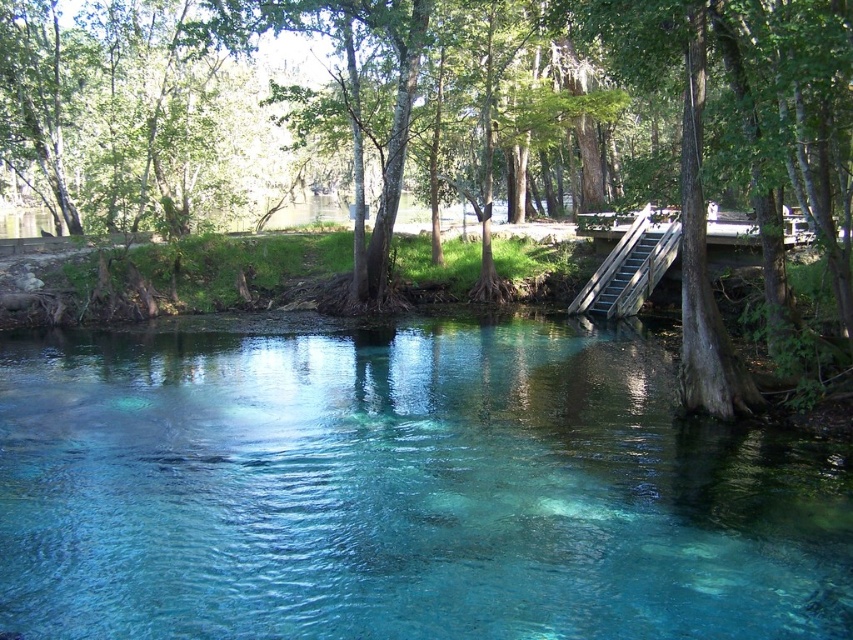
Which is behind, point (4, 580) or point (664, 246)?

Positioned behind is point (664, 246).

Is point (143, 483) in front of point (643, 257)?

Yes, it is in front of point (643, 257).

Find the location of `clear glassy water at center`. clear glassy water at center is located at coordinates (399, 492).

This screenshot has width=853, height=640. I want to click on clear glassy water at center, so click(x=399, y=492).

Does clear glassy water at center have a lesser height compared to green rough bark tree at center?

Correct, clear glassy water at center is not as tall as green rough bark tree at center.

Is point (223, 589) positioned behind point (659, 17)?

No, (223, 589) is in front of (659, 17).

Where is `clear glassy water at center`? clear glassy water at center is located at coordinates (399, 492).

Is point (163, 129) in front of point (602, 262)?

No, (163, 129) is behind (602, 262).

Locate an element on the screen. green rough bark tree at center is located at coordinates (357, 115).